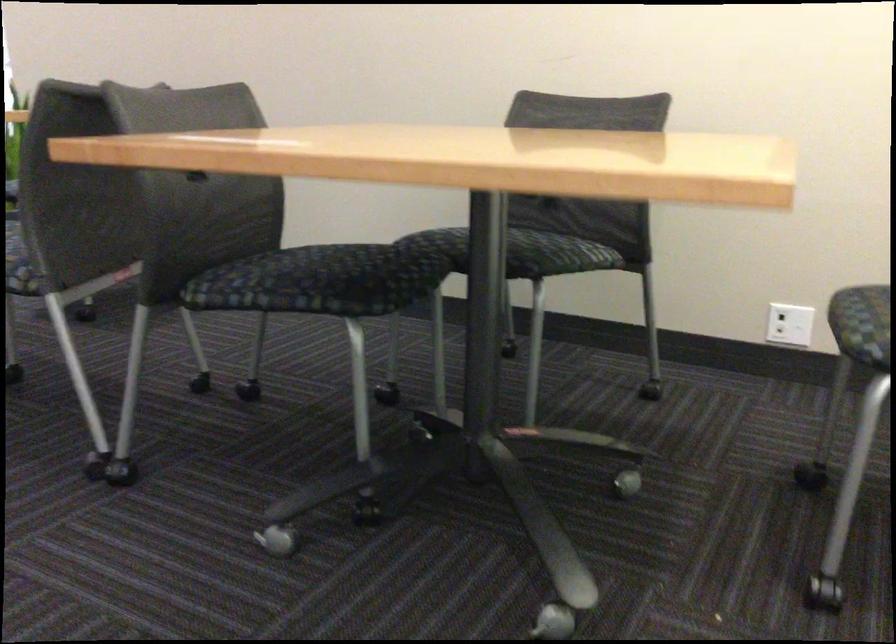
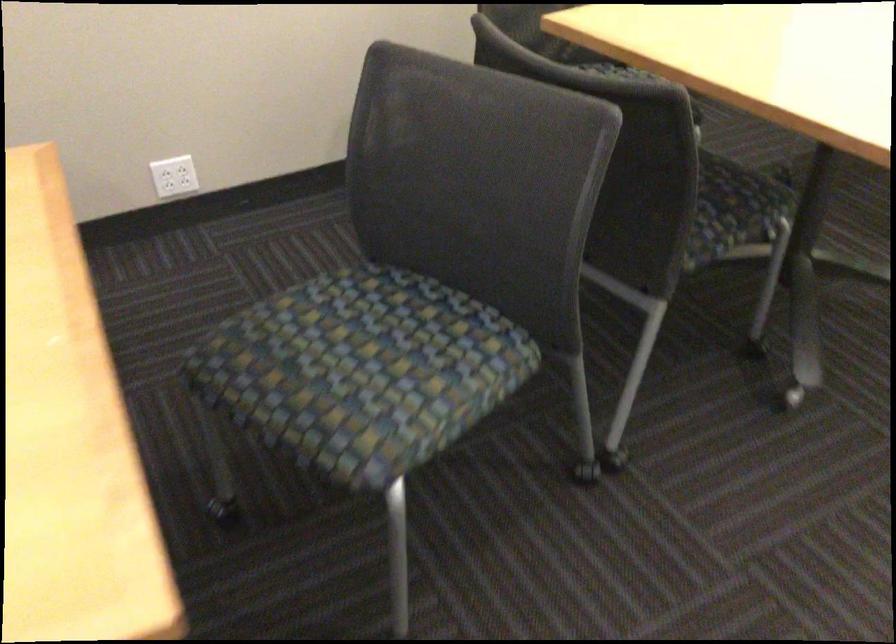
Where in the second image is the point corresponding to point (291, 286) from the first image?

(736, 205)